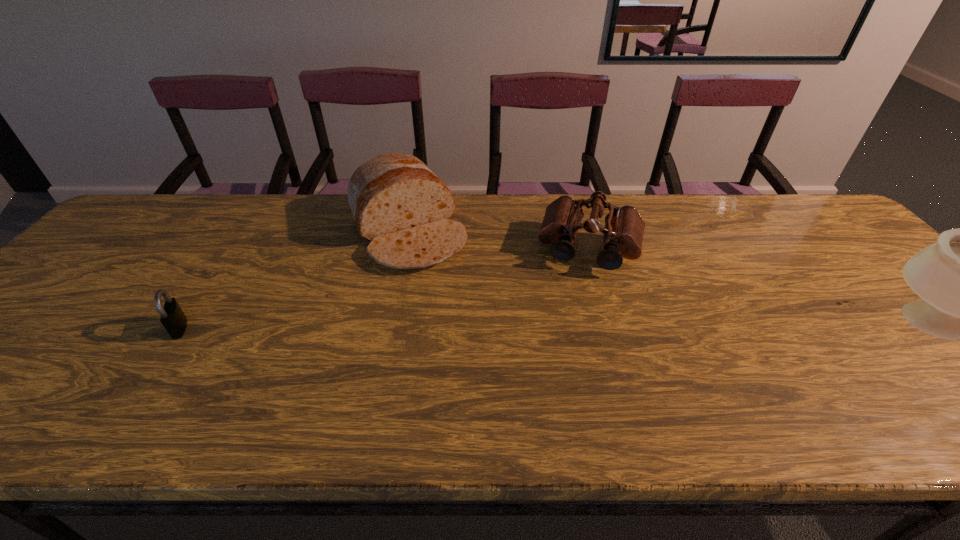
This screenshot has height=540, width=960. What are the coordinates of `unoccupied position between the bread and the leftmost object` in the screenshot? It's located at (293, 279).

Image resolution: width=960 pixels, height=540 pixels. Identify the location of empty space between the second shortest object and the shortest object. (385, 288).

This screenshot has height=540, width=960. I want to click on free space that is in between the padlock and the bread, so click(293, 279).

The image size is (960, 540). I want to click on object that is the second closest to the second shortest object, so click(959, 277).

Identify which object is the third nearest to the second object from right to left. Please provide its 2D coordinates. Your answer should be formatted as a tuple, i.e. [(x, y)], where the tuple contains the x and y coordinates of a point satisfying the conditions above.

[(172, 317)]

Locate an element on the screen. vacant point that satisfies the following two spatial constraints: 1. on the back side of the second tallest object; 2. on the right side of the padlock is located at coordinates (245, 231).

Locate an element on the screen. The image size is (960, 540). vacant space that satisfies the following two spatial constraints: 1. on the back side of the leftmost object; 2. on the right side of the binoculars is located at coordinates (232, 248).